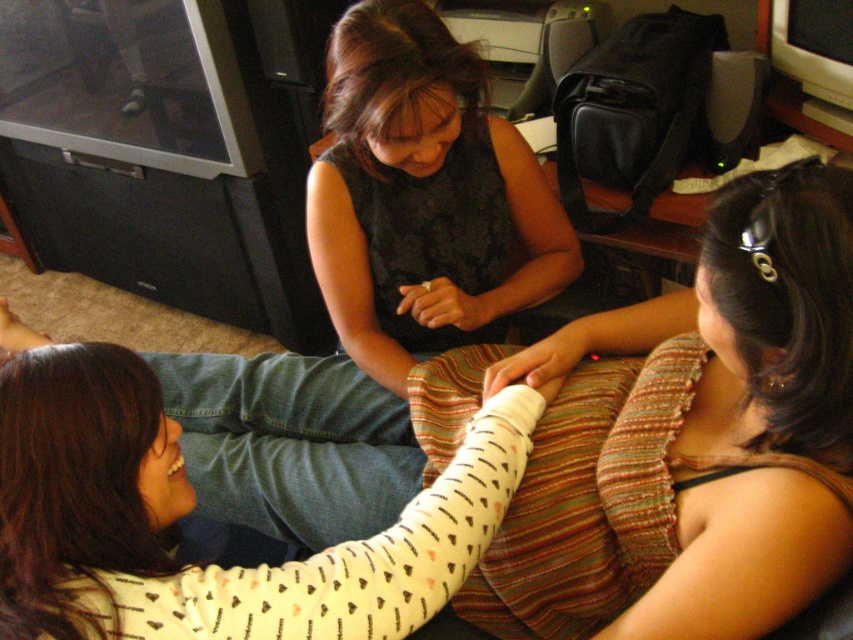
Question: Is black textured dress at center above black matte dress at center?

Choices:
 (A) yes
 (B) no

Answer: (B)

Question: Estimate the real-world distances between objects in this image. Which object is closer to the white textured bandage at center?

Choices:
 (A) white dotted sweater at lower left
 (B) black matte dress at center
 (C) black textured dress at center

Answer: (C)

Question: Which object is the closest to the white matte hand at lower left?

Choices:
 (A) dark textured blouse at center
 (B) black matte dress at center

Answer: (A)

Question: Can you confirm if black matte dress at center is bigger than white textured bandage at center?

Choices:
 (A) no
 (B) yes

Answer: (B)

Question: Can you confirm if black textured dress at center is positioned below black matte dress at center?

Choices:
 (A) yes
 (B) no

Answer: (A)

Question: Among these objects, which one is farthest from the camera?

Choices:
 (A) white matte hand at lower left
 (B) matte black hands at center

Answer: (B)